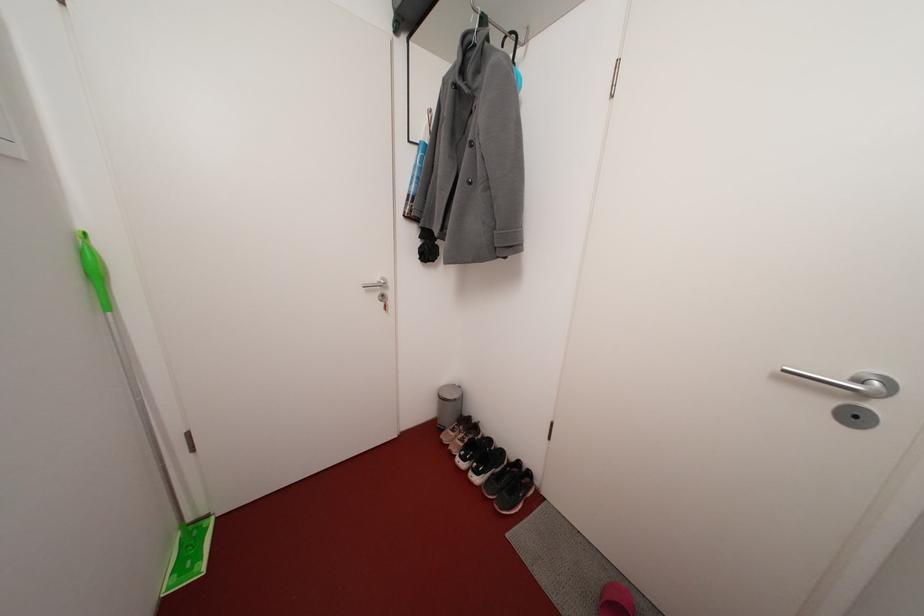
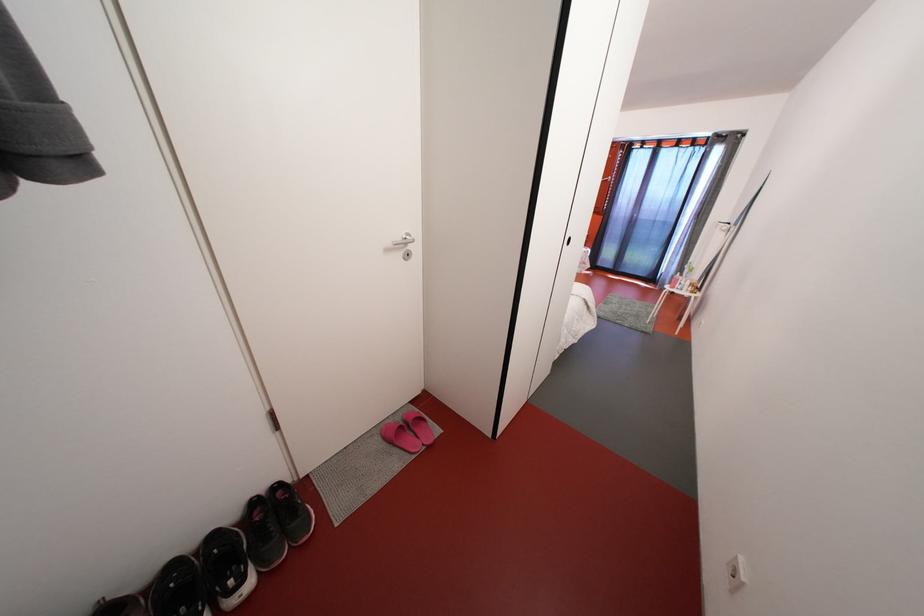
Based on the continuous images, in which direction is the camera rotating?

The camera rotated toward right-down.